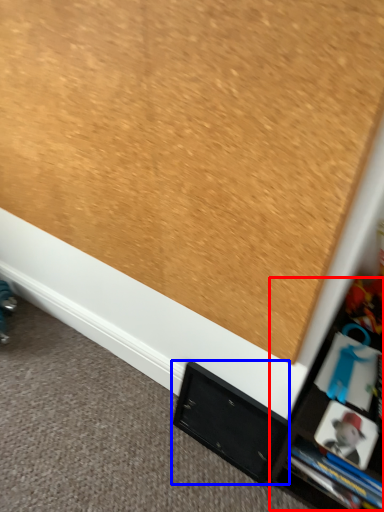
Question: Which object appears closest to the camera in this image, tv cabinet (highlighted by a red box) or cabinet (highlighted by a blue box)?

Choices:
 (A) tv cabinet
 (B) cabinet

Answer: (A)